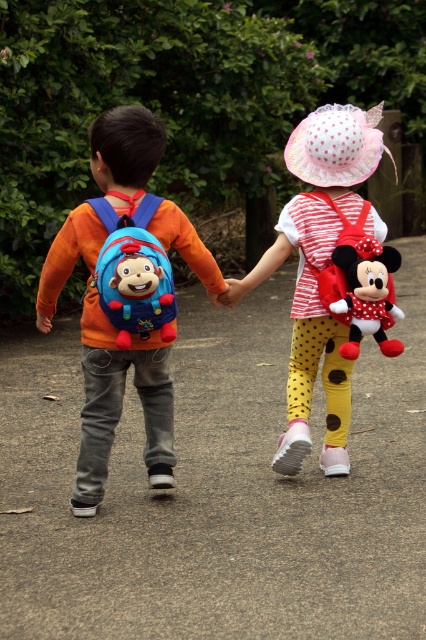
You are a photographer trying to capture a photo of the two children walking. You notice the matte blue backpack at left and the polka dot fabric dress at center. Which object should you focus on first if you want to include both in your frame without moving the camera?

You should focus on the matte blue backpack at left first because it is positioned to the left of the polka dot fabric dress at center, so capturing it first ensures both objects are within the frame.

You are a photographer trying to capture a photo of the two children walking. You want to ensure both the matte blue fabric backpack at left and the red plush minnie mouse at back are clearly visible in the frame. Based on their positions, which backpack is closer to the center of the image?

The matte blue fabric backpack at left is to the left of red plush minnie mouse at back, so the red plush minnie mouse at back is closer to the center of the image.